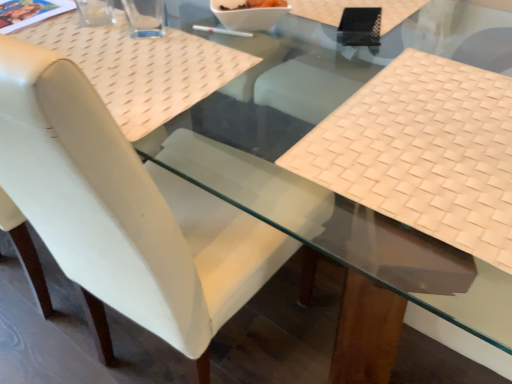
In order to click on free region on the left part of white plastic chopstick at center in this screenshot , I will do `click(150, 37)`.